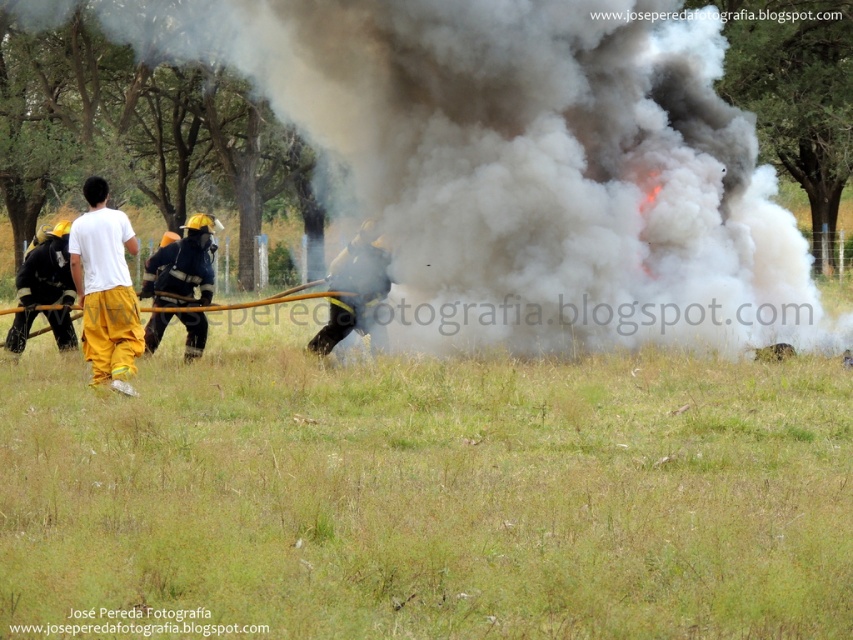
Is black smoke at center smaller than black matte firefighter at center?

No.

From the picture: Who is more distant from viewer, (x=556, y=134) or (x=381, y=296)?

Positioned behind is point (x=381, y=296).

Locate an element on the screen. This screenshot has width=853, height=640. black smoke at center is located at coordinates (531, 163).

Is black smoke at center shorter than white cotton shirt at left?

No.

Is point (408, 224) positioned behind point (90, 221)?

That is True.

Between point (440, 122) and point (103, 296), which one is positioned behind?

Point (440, 122)

Where is `black smoke at center`? black smoke at center is located at coordinates (531, 163).

Can you confirm if green grass at center is smaller than white cotton shirt at left?

No.

The width and height of the screenshot is (853, 640). What do you see at coordinates (426, 497) in the screenshot?
I see `green grass at center` at bounding box center [426, 497].

Between point (180, 561) and point (138, 339), which one is positioned in front?

Point (180, 561)

The width and height of the screenshot is (853, 640). I want to click on green grass at center, so click(x=426, y=497).